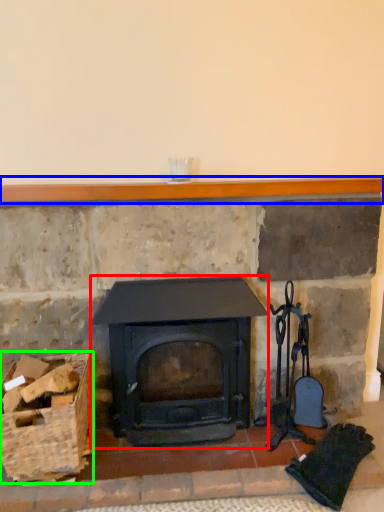
Question: Based on their relative distances, which object is farther from wood burning stove (highlighted by a red box)? Choose from balustrade (highlighted by a blue box) and basket (highlighted by a green box).

Choices:
 (A) balustrade
 (B) basket

Answer: (A)